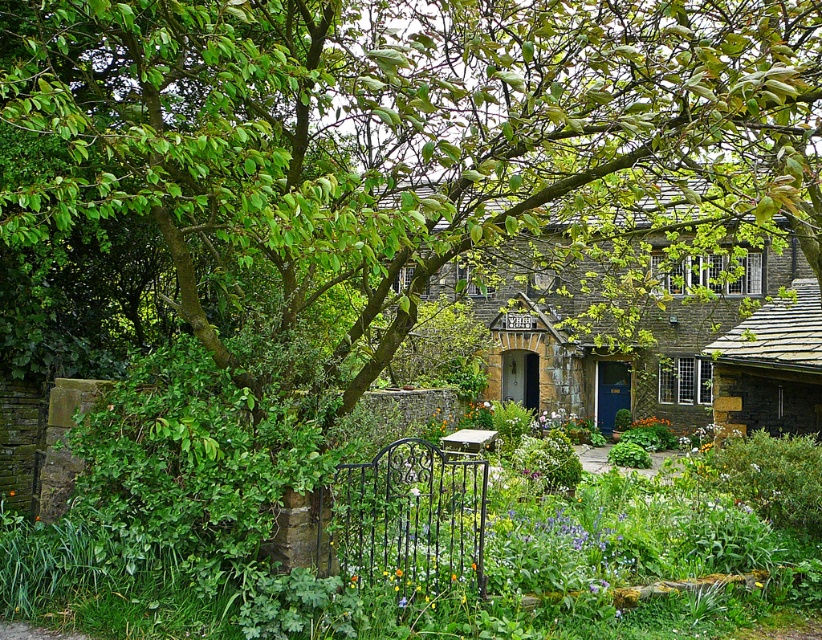
Question: Can you confirm if green leafy bush at lower left is positioned to the left of brown stone cottage at center?

Choices:
 (A) no
 (B) yes

Answer: (B)

Question: Can you confirm if green leafy bush at lower left is smaller than brown stone cottage at center?

Choices:
 (A) no
 (B) yes

Answer: (B)

Question: Which point appears closest to the camera in this image?

Choices:
 (A) (784, 333)
 (B) (368, 528)

Answer: (B)

Question: Which of the following is the closest to the observer?

Choices:
 (A) (730, 528)
 (B) (550, 348)

Answer: (A)

Question: Is green leafy bush at lower left to the right of brown stone cottage at center from the viewer's perspective?

Choices:
 (A) no
 (B) yes

Answer: (A)